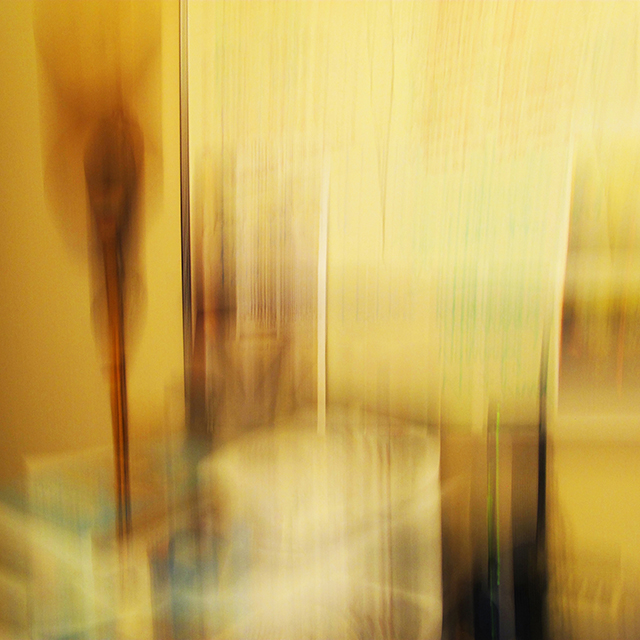
At what (x,y) coordinates should I click in order to perform the action: click on spoon. Please return your answer as a coordinate pair (x, y). The image size is (640, 640). Looking at the image, I should click on (124, 496), (108, 304), (118, 203).